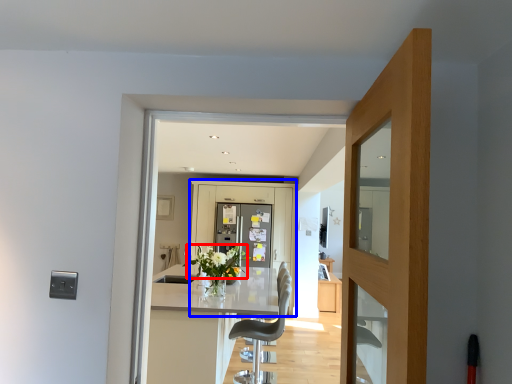
Question: Which object appears closest to the camera in this image, flower (highlighted by a red box) or barn door (highlighted by a blue box)?

Choices:
 (A) flower
 (B) barn door

Answer: (A)